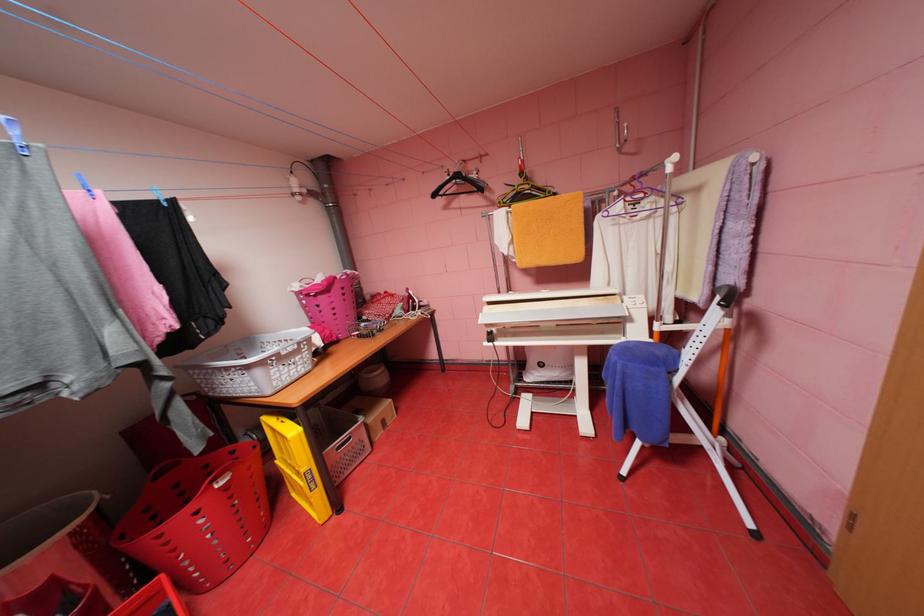
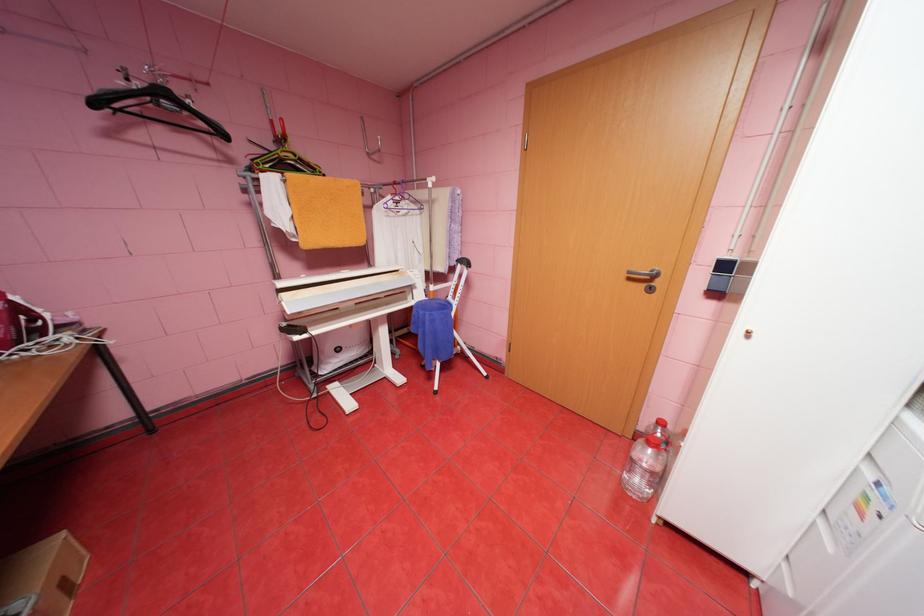
In the second image, find the point that corresponds to (x=443, y=195) in the first image.

(103, 103)